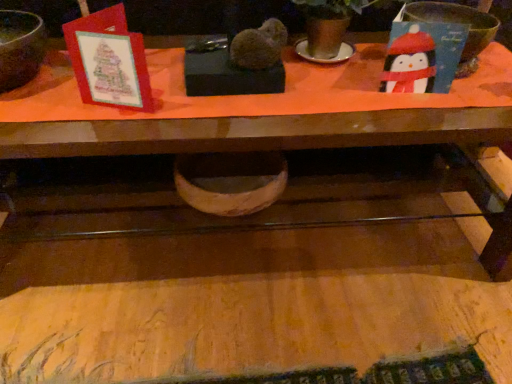
Question: From a real-world perspective, does wooden bowl at center, acting as the 1th basin starting from the bottom, stand above matte brown mixing bowl at upper left?

Choices:
 (A) no
 (B) yes

Answer: (A)

Question: Considering the relative sizes of wooden bowl at center, positioned as the second basin in right-to-left order, and matte brown mixing bowl at upper left in the image provided, is wooden bowl at center, positioned as the second basin in right-to-left order, shorter than matte brown mixing bowl at upper left?

Choices:
 (A) no
 (B) yes

Answer: (B)

Question: From the image's perspective, is wooden bowl at center, positioned as the second basin in right-to-left order, on top of matte brown mixing bowl at upper left?

Choices:
 (A) yes
 (B) no

Answer: (B)

Question: Could you tell me if wooden bowl at center, positioned as the second basin in right-to-left order, is facing matte brown mixing bowl at upper left?

Choices:
 (A) yes
 (B) no

Answer: (B)

Question: Is wooden bowl at center, positioned as the second basin in right-to-left order, in front of matte brown mixing bowl at upper left?

Choices:
 (A) no
 (B) yes

Answer: (A)

Question: Does wooden bowl at center, marked as the 2th basin in a top-to-bottom arrangement, appear on the left side of matte brown mixing bowl at upper left?

Choices:
 (A) no
 (B) yes

Answer: (A)

Question: Is matte brown mixing bowl at upper left shorter than wooden bowl at center, marked as the 2th basin in a top-to-bottom arrangement?

Choices:
 (A) no
 (B) yes

Answer: (A)

Question: Can you confirm if matte brown mixing bowl at upper left is thinner than wooden bowl at center, positioned as the first basin in left-to-right order?

Choices:
 (A) yes
 (B) no

Answer: (A)

Question: Can you see matte brown mixing bowl at upper left touching wooden bowl at center, acting as the 1th basin starting from the bottom?

Choices:
 (A) no
 (B) yes

Answer: (A)

Question: From a real-world perspective, is matte brown mixing bowl at upper left located beneath wooden bowl at center, marked as the 2th basin in a top-to-bottom arrangement?

Choices:
 (A) yes
 (B) no

Answer: (B)

Question: Could wooden bowl at center, marked as the 2th basin in a top-to-bottom arrangement, be considered to be inside matte brown mixing bowl at upper left?

Choices:
 (A) yes
 (B) no

Answer: (B)

Question: Considering the relative sizes of matte brown mixing bowl at upper left and wooden bowl at center, marked as the 2th basin in a top-to-bottom arrangement, in the image provided, is matte brown mixing bowl at upper left wider than wooden bowl at center, marked as the 2th basin in a top-to-bottom arrangement,?

Choices:
 (A) no
 (B) yes

Answer: (A)

Question: Considering the relative positions of matte black bowl at right, the 1th basin from the top, and wooden table at lower center in the image provided, is matte black bowl at right, the 1th basin from the top, behind wooden table at lower center?

Choices:
 (A) yes
 (B) no

Answer: (A)